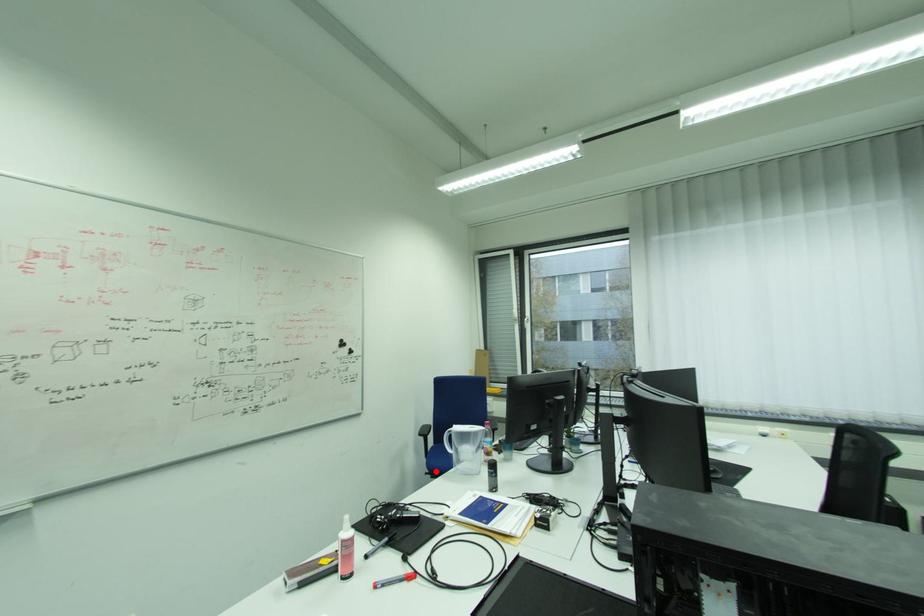
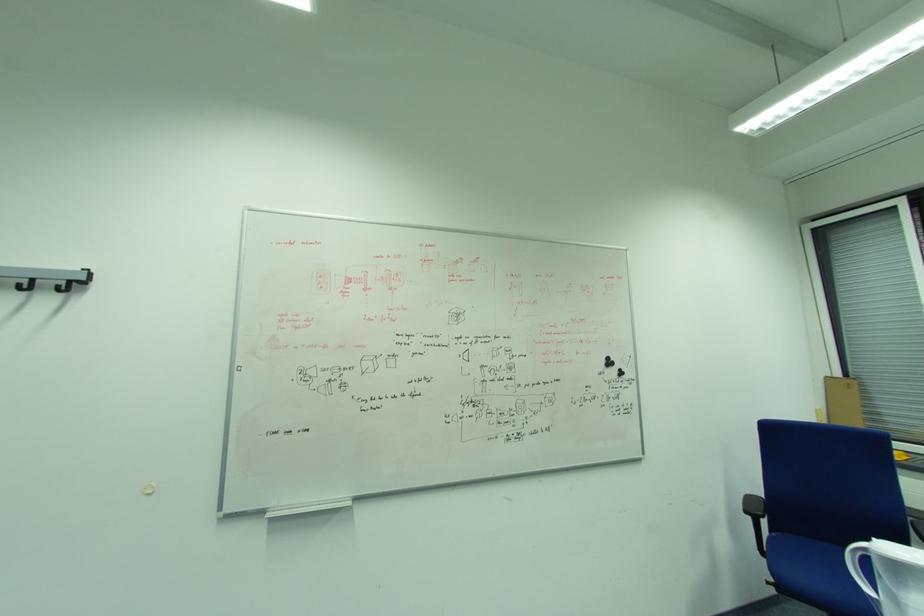
Where in the second image is the point corresponding to the highlighted location from the first image?

(782, 582)